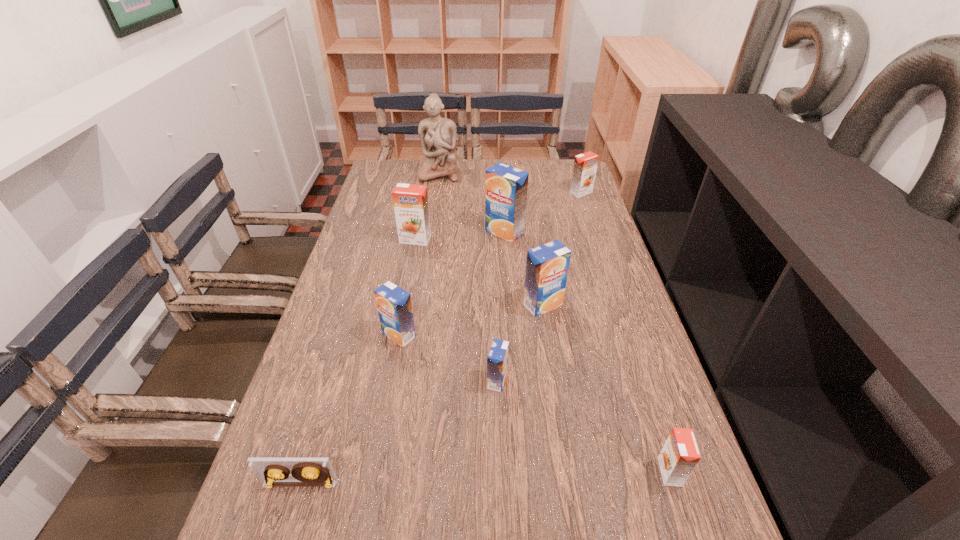
In order to click on vacant space that satisfies the following two spatial constraints: 1. on the back side of the farthest orange juice; 2. on the left side of the biggest blue orange_juice in this screenshot , I will do `click(502, 193)`.

You are a GUI agent. You are given a task and a screenshot of the screen. Output one action in this format:
    pyautogui.click(x=<x>, y=<y>)
    Task: Click on the free space that satisfies the following two spatial constraints: 1. on the front-facing side of the farthest object; 2. on the right side of the second biggest orange orange juice
    This screenshot has width=960, height=540.
    Given the screenshot: What is the action you would take?
    pyautogui.click(x=436, y=193)

Where is `blank area in the image that satisfies the following two spatial constraints: 1. on the front side of the leftmost orange orange juice; 2. on the left side of the nearest blue orange_juice`? blank area in the image that satisfies the following two spatial constraints: 1. on the front side of the leftmost orange orange juice; 2. on the left side of the nearest blue orange_juice is located at coordinates (389, 381).